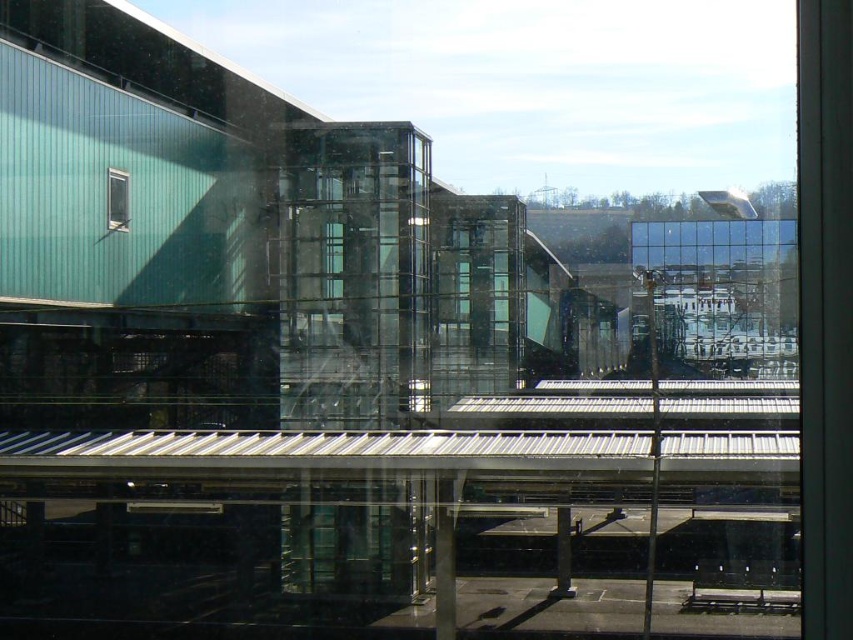
You are an architect designing a new building and want to use the same type of glass as the transparent glass window at center and clear glass window at upper left. Which of these two windows has a greater width?

The transparent glass window at center has a greater width than the clear glass window at upper left according to the description.

You are an architect designing a new building and want to place a new decorative element exactly at the center of the transparent glass window at center. According to the coordinates provided, where should you place the decorative element?

The decorative element should be placed at the coordinates point [332,259], which is the center of the transparent glass window at center as specified.